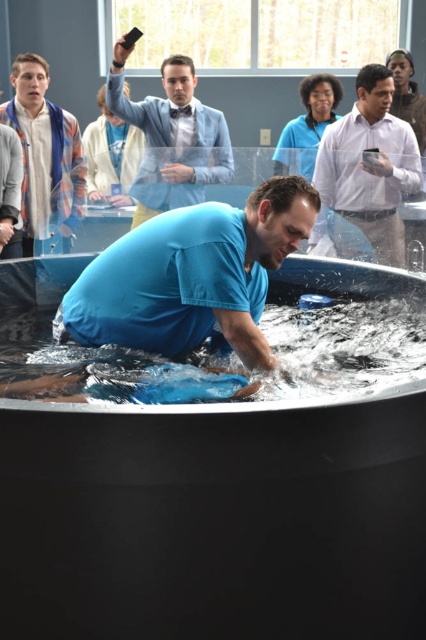
Does blue denim shirt at upper left have a lesser width compared to light blue shirt at upper left?

Incorrect, blue denim shirt at upper left's width is not less than light blue shirt at upper left's.

Who is lower down, blue denim shirt at upper left or light blue shirt at upper left?

light blue shirt at upper left is below.

Who is more distant from viewer, (40, 96) or (17, 157)?

The point (40, 96) is behind.

This screenshot has width=426, height=640. I want to click on blue denim shirt at upper left, so click(x=45, y=154).

Is blue plastic tub at center shorter than blue denim shirt at upper left?

Yes.

Describe the element at coordinates (215, 520) in the screenshot. I see `blue plastic tub at center` at that location.

Describe the element at coordinates (215, 520) in the screenshot. I see `blue plastic tub at center` at that location.

In order to click on blue plastic tub at center in this screenshot , I will do `click(215, 520)`.

Is point (120, 104) less distant than point (19, 256)?

No.

Which is below, light blue shirt at upper center or light blue shirt at upper left?

light blue shirt at upper left is below.

The height and width of the screenshot is (640, 426). Find the location of `light blue shirt at upper center`. light blue shirt at upper center is located at coordinates (172, 136).